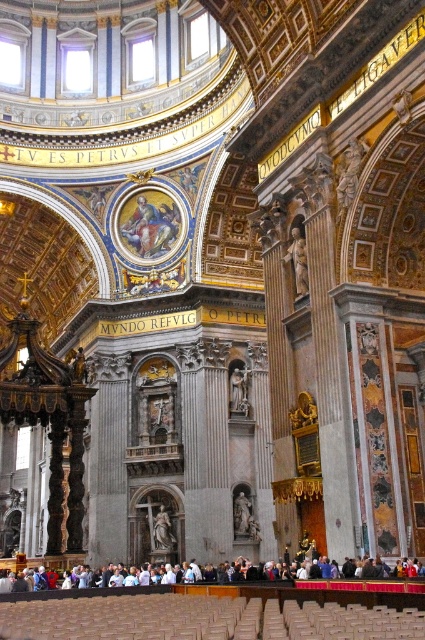
Question: Which of the following is the farthest from the observer?

Choices:
 (A) (172, 548)
 (B) (328, 579)

Answer: (A)

Question: Which point appears farthest from the camera in this image?

Choices:
 (A) (155, 518)
 (B) (206, 588)

Answer: (A)

Question: Is white marble statue at center to the right of smooth marble statue at center from the viewer's perspective?

Choices:
 (A) yes
 (B) no

Answer: (B)

Question: Can you confirm if white marble statue at center is positioned to the right of smooth marble statue at center?

Choices:
 (A) yes
 (B) no

Answer: (B)

Question: Does white marble statue at center have a smaller size compared to smooth marble statue at center?

Choices:
 (A) no
 (B) yes

Answer: (A)